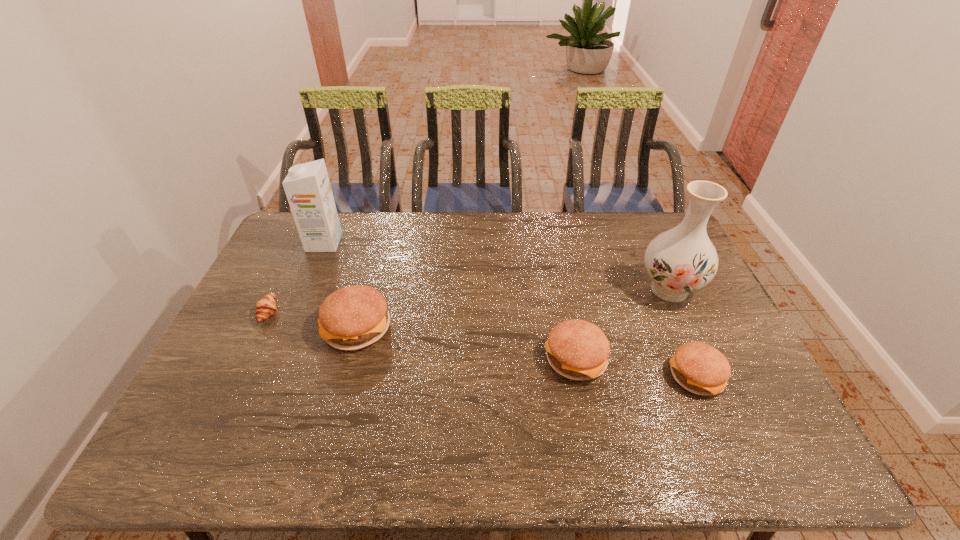
You are a GUI agent. You are given a task and a screenshot of the screen. Output one action in this format:
    pyautogui.click(x=<x>, y=<y>)
    Task: Click on the free space between the shortest object and the tallest object
    The image size is (960, 540).
    Given the screenshot: What is the action you would take?
    pyautogui.click(x=468, y=301)

The height and width of the screenshot is (540, 960). I want to click on unoccupied area between the tallest object and the fourth object from right to left, so click(x=514, y=308).

Where is `free space between the vase and the shortest object`? free space between the vase and the shortest object is located at coordinates (468, 301).

Find the location of a particular element. The width and height of the screenshot is (960, 540). free space that is in between the second tallest object and the shortest object is located at coordinates (297, 277).

Where is `unoccupied position between the vase and the third object from right to left`? unoccupied position between the vase and the third object from right to left is located at coordinates (622, 325).

Locate an element on the screen. This screenshot has width=960, height=540. free area in between the fourth tallest object and the farthest object is located at coordinates (449, 301).

Locate an element on the screen. Image resolution: width=960 pixels, height=540 pixels. blank region between the second tallest object and the shortest object is located at coordinates (297, 277).

Point out which object is positioned as the nearest to the carton. Please provide its 2D coordinates. Your answer should be formatted as a tuple, i.e. [(x, y)], where the tuple contains the x and y coordinates of a point satisfying the conditions above.

[(266, 306)]

Choose which object is the nearest neighbor to the vase. Please provide its 2D coordinates. Your answer should be formatted as a tuple, i.e. [(x, y)], where the tuple contains the x and y coordinates of a point satisfying the conditions above.

[(699, 368)]

At what (x,y) coordinates should I click in order to perform the action: click on the second closest hamburger to the pastry. Please return your answer as a coordinate pair (x, y). This screenshot has height=540, width=960. Looking at the image, I should click on (576, 349).